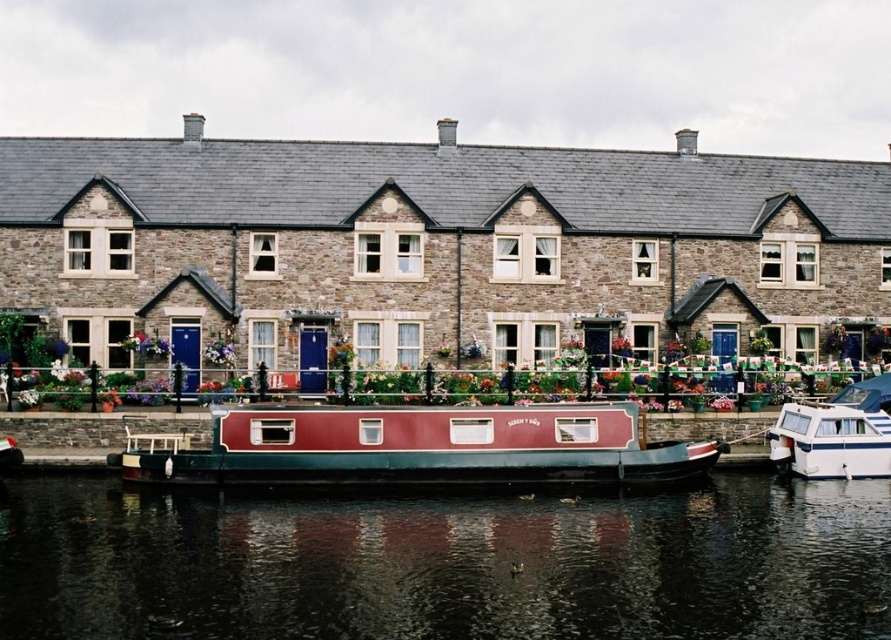
You are a tourist standing on the riverside path. You want to take a photo of both the maroon polished wood barge at center and the white glossy boat at lower right. Which boat should you position yourself closer to in order to capture both in the same frame?

Since the maroon polished wood barge at center is located below the white glossy boat at lower right, you should position yourself closer to the white glossy boat at lower right to include both in your photo.

You are a tour guide leading a group along the riverside. You want to inform your group about the two boats. How far apart are the maroon polished wood barge at center and the white glossy boat at lower right?

The distance between the maroon polished wood barge at center and the white glossy boat at lower right is 9.88 meters.

You are standing on the riverside path and want to take a photo of the white glossy boat at lower right and the smooth dark water at center. Which object should you focus on first if you want to capture both in one shot?

The smooth dark water at center is below the white glossy boat at lower right, so you should focus on the white glossy boat at lower right first as it is closer to you.